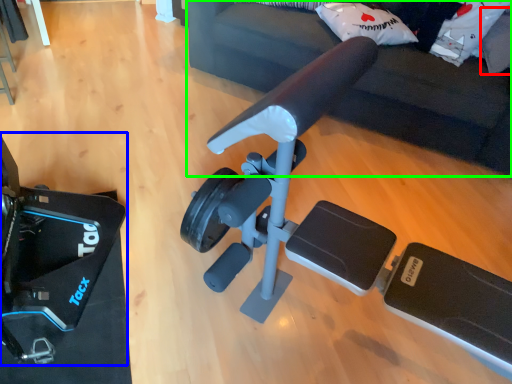
Question: Which is farther away from pillow (highlighted by a red box)? video camera (highlighted by a blue box) or furniture (highlighted by a green box)?

Choices:
 (A) video camera
 (B) furniture

Answer: (A)